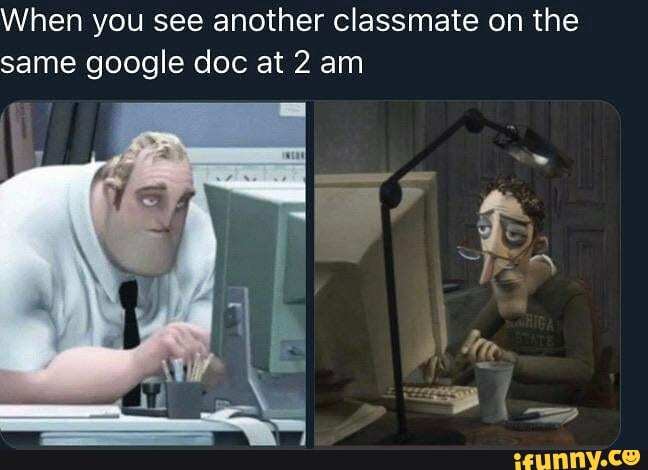
Where is `keyboard`? The height and width of the screenshot is (470, 648). keyboard is located at coordinates (418, 394).